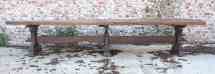
Where is `wood bench`? Image resolution: width=215 pixels, height=74 pixels. wood bench is located at coordinates (89, 23).